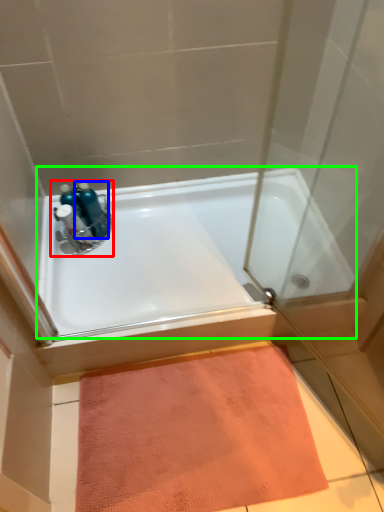
Question: Which is farther away from sink (highlighted by a red box)? bottle (highlighted by a blue box) or bathtub (highlighted by a green box)?

Choices:
 (A) bottle
 (B) bathtub

Answer: (B)